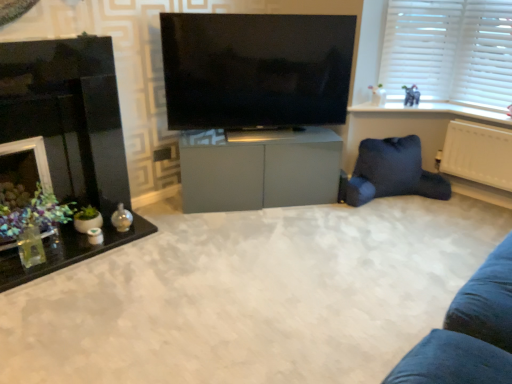
Question: Is point (470, 94) closer or farther from the camera than point (436, 301)?

Choices:
 (A) farther
 (B) closer

Answer: (A)

Question: From the image's perspective, relative to matte gray cabinet at center, is white plastic blinds at upper right above or below?

Choices:
 (A) above
 (B) below

Answer: (A)

Question: Estimate the real-world distances between objects in this image. Which object is farther from the flat screen tv at center?

Choices:
 (A) dark blue fabric bean bag at lower right
 (B) matte gray cabinet at center
 (C) matte gray elephant at upper right
 (D) white plastic radiator at right
 (E) matte gray cabinet at center

Answer: (D)

Question: Which object is the farthest from the white plastic radiator at right?

Choices:
 (A) matte gray cabinet at center
 (B) dark blue fabric bean bag at lower right
 (C) translucent glass table at left
 (D) flat screen tv at center
 (E) white plastic blinds at upper right

Answer: (C)